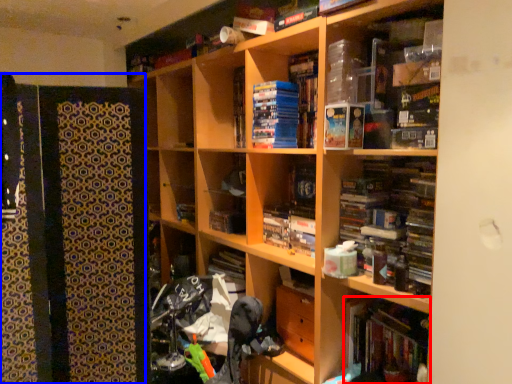
Question: Among these objects, which one is farthest to the camera, book (highlighted by a red box) or cabinet (highlighted by a blue box)?

Choices:
 (A) book
 (B) cabinet

Answer: (A)